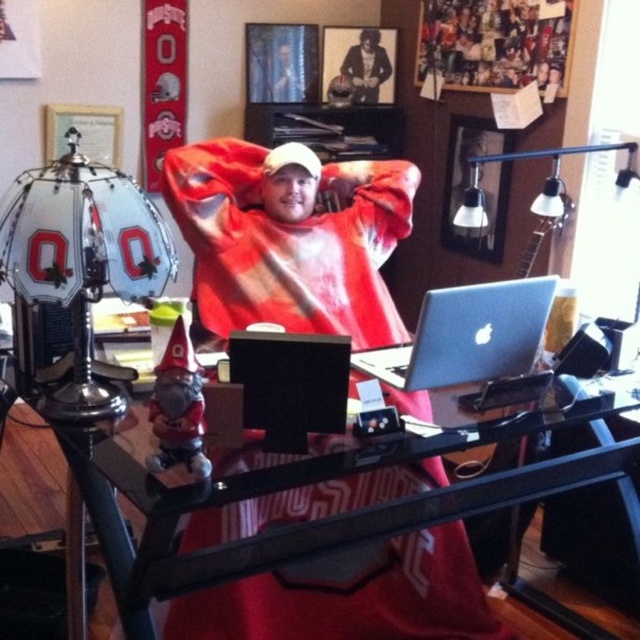
Question: Is red cotton shirt at center below black plastic laptop at center?

Choices:
 (A) no
 (B) yes

Answer: (A)

Question: Which object is the farthest from the transparent glass table at center?

Choices:
 (A) black plastic laptop at center
 (B) silver metallic laptop at center
 (C) shiny black leather jacket at upper center

Answer: (C)

Question: Is transparent glass table at center wider than shiny black leather jacket at upper center?

Choices:
 (A) yes
 (B) no

Answer: (A)

Question: Can you confirm if transparent glass table at center is smaller than black plastic laptop at center?

Choices:
 (A) no
 (B) yes

Answer: (A)

Question: Which point is farther to the camera?

Choices:
 (A) (243, 364)
 (B) (365, 164)
 (C) (566, 596)

Answer: (B)

Question: Which point is farther to the camera?

Choices:
 (A) (269, 186)
 (B) (372, 28)
 (C) (630, 512)
 (D) (298, 376)

Answer: (B)